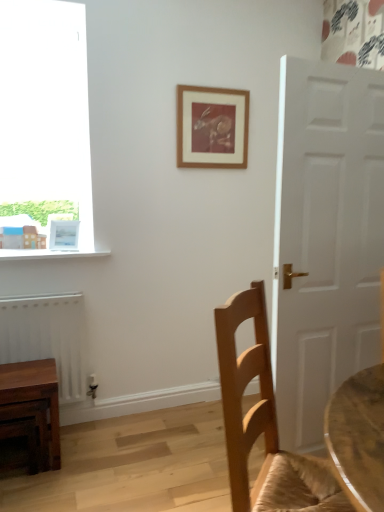
Question: Can you confirm if wooden table at lower left is positioned to the right of wooden picture frame at upper center, marked as the 2th picture frame in a left-to-right arrangement?

Choices:
 (A) no
 (B) yes

Answer: (A)

Question: Is wooden table at lower left positioned beyond the bounds of wooden picture frame at upper center, marked as the 2th picture frame in a left-to-right arrangement?

Choices:
 (A) no
 (B) yes

Answer: (B)

Question: Can you confirm if wooden table at lower left is bigger than wooden picture frame at upper center, marked as the 2th picture frame in a left-to-right arrangement?

Choices:
 (A) no
 (B) yes

Answer: (B)

Question: Does wooden table at lower left come behind wooden picture frame at upper center, arranged as the first picture frame when viewed from the top?

Choices:
 (A) no
 (B) yes

Answer: (A)

Question: From the image's perspective, is wooden table at lower left below wooden picture frame at upper center, arranged as the first picture frame when viewed from the top?

Choices:
 (A) yes
 (B) no

Answer: (A)

Question: Based on their positions, is wooden picture frame at upper center, arranged as the first picture frame when viewed from the top, located to the left or right of light brown wood chair at right?

Choices:
 (A) right
 (B) left

Answer: (B)

Question: In the image, is wooden picture frame at upper center, which is counted as the 2th picture frame, starting from the bottom, positioned in front of or behind light brown wood chair at right?

Choices:
 (A) behind
 (B) front

Answer: (A)

Question: In terms of size, does wooden picture frame at upper center, arranged as the first picture frame when viewed from the top, appear bigger or smaller than light brown wood chair at right?

Choices:
 (A) small
 (B) big

Answer: (A)

Question: Considering the positions of point (200, 117) and point (266, 467), is point (200, 117) closer or farther from the camera than point (266, 467)?

Choices:
 (A) closer
 (B) farther

Answer: (B)

Question: Is wooden table at lower left to the left or to the right of white matte radiator at lower left in the image?

Choices:
 (A) left
 (B) right

Answer: (A)

Question: From the image's perspective, is wooden table at lower left positioned above or below white matte radiator at lower left?

Choices:
 (A) above
 (B) below

Answer: (B)

Question: Considering the positions of wooden table at lower left and white matte radiator at lower left in the image, is wooden table at lower left bigger or smaller than white matte radiator at lower left?

Choices:
 (A) small
 (B) big

Answer: (A)

Question: Is wooden table at lower left spatially inside white matte radiator at lower left, or outside of it?

Choices:
 (A) inside
 (B) outside

Answer: (B)

Question: Looking at their shapes, would you say white glossy picture frame at upper left, which appears as the 1th picture frame when ordered from the bottom, is wider or thinner than white matte radiator at lower left?

Choices:
 (A) thin
 (B) wide

Answer: (A)

Question: In terms of size, does white glossy picture frame at upper left, acting as the 1th picture frame starting from the left, appear bigger or smaller than white matte radiator at lower left?

Choices:
 (A) big
 (B) small

Answer: (B)